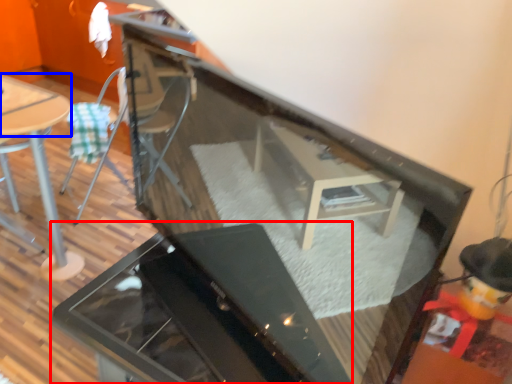
Question: Which object is further to the camera taking this photo, grill (highlighted by a red box) or table top (highlighted by a blue box)?

Choices:
 (A) grill
 (B) table top

Answer: (B)